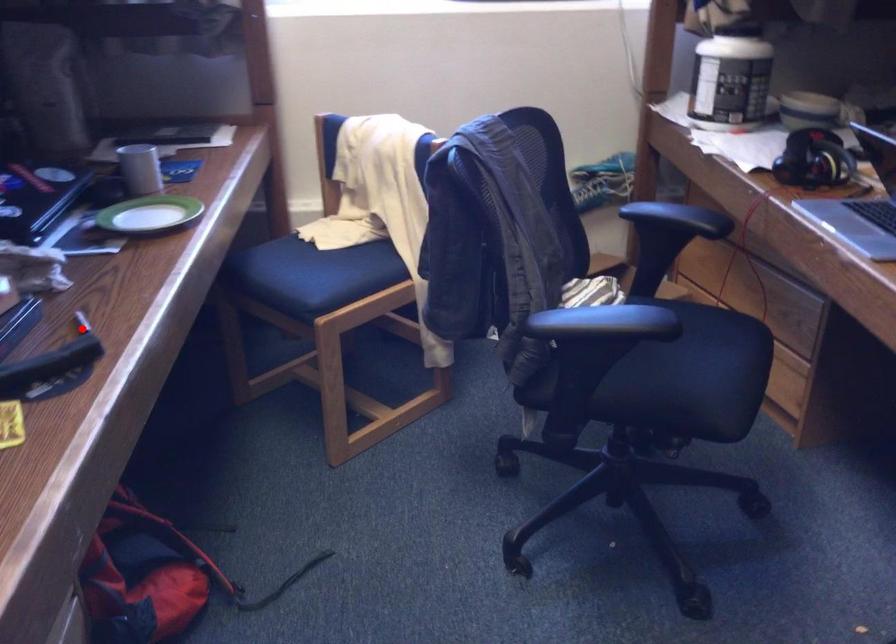
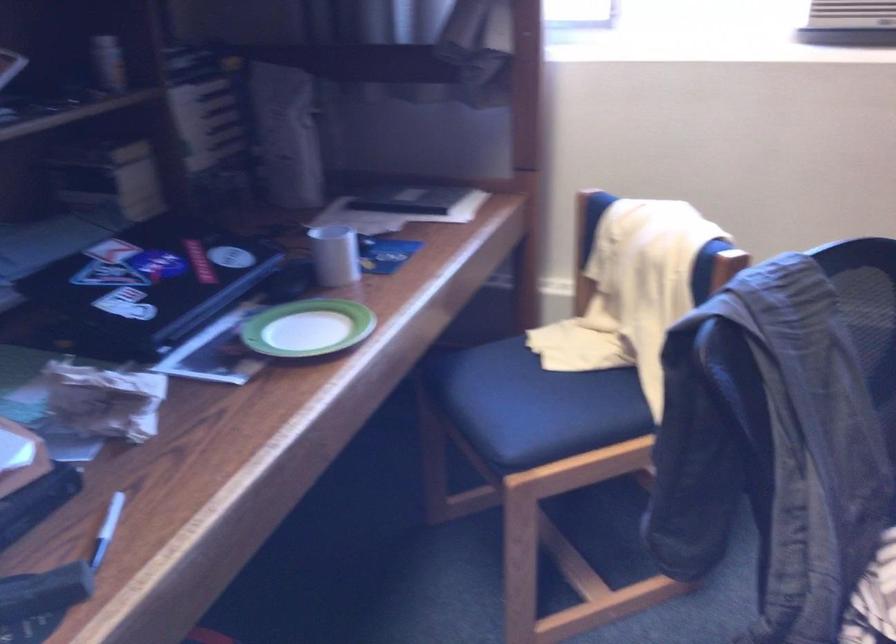
Where in the second image is the point corresponding to the highlighted location from the first image?

(107, 529)